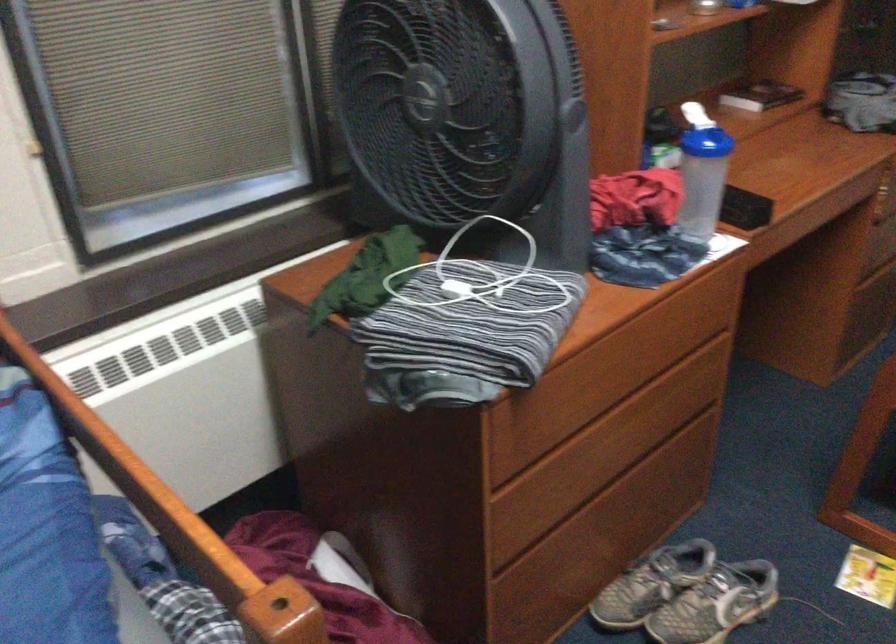
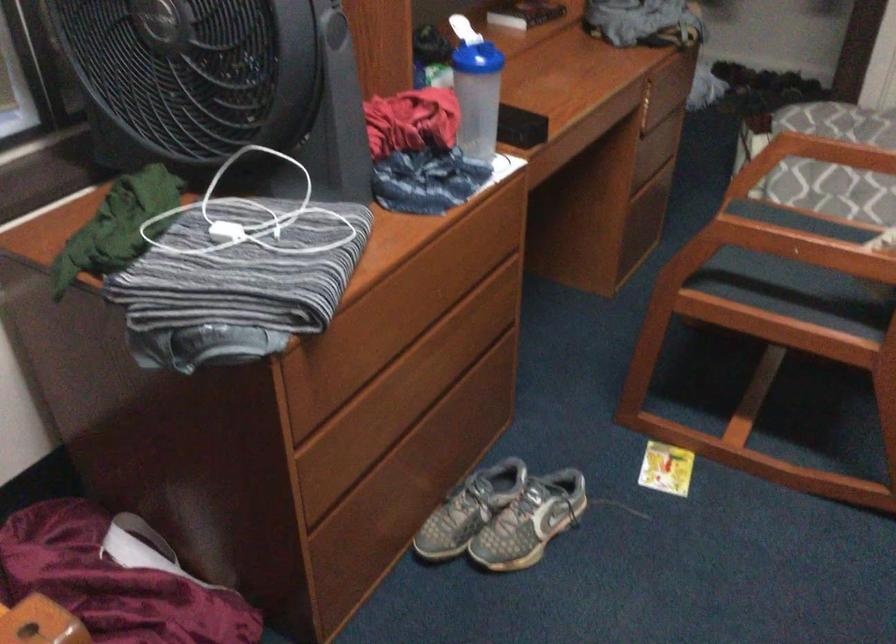
Locate, in the second image, the point that corresponds to pixel 529 556 in the first image.

(343, 506)